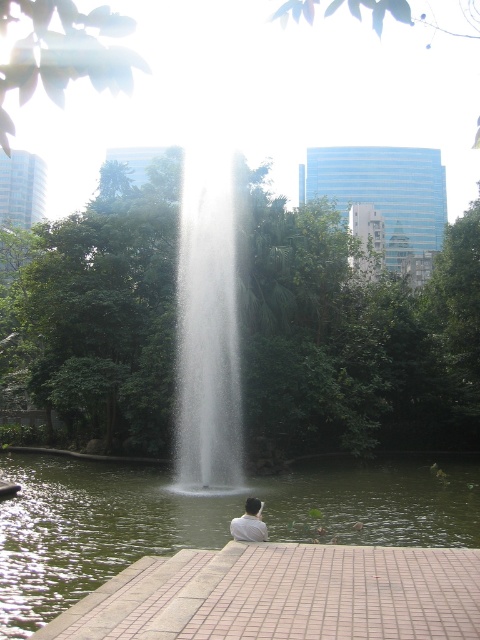
Question: Is green liquid water at center to the left of white matte shirt at lower center from the viewer's perspective?

Choices:
 (A) yes
 (B) no

Answer: (A)

Question: Does green liquid water at center have a lesser width compared to white matte shirt at lower center?

Choices:
 (A) yes
 (B) no

Answer: (B)

Question: Which point appears closest to the camera in this image?

Choices:
 (A) (88, 496)
 (B) (237, 529)

Answer: (B)

Question: Observing the image, what is the correct spatial positioning of green liquid water at center in reference to white matte shirt at lower center?

Choices:
 (A) below
 (B) above

Answer: (A)

Question: Which point is closer to the camera?

Choices:
 (A) (282, 490)
 (B) (233, 532)

Answer: (B)